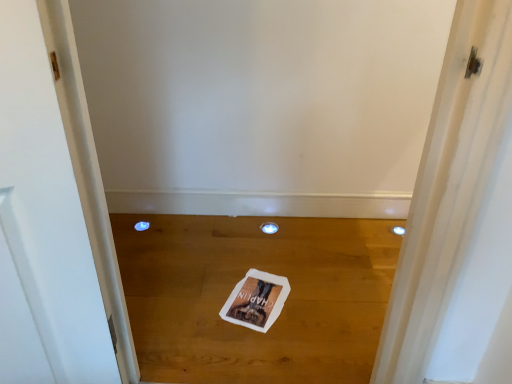
The width and height of the screenshot is (512, 384). Find the location of `free space behind white paper magazine at center`. free space behind white paper magazine at center is located at coordinates (253, 254).